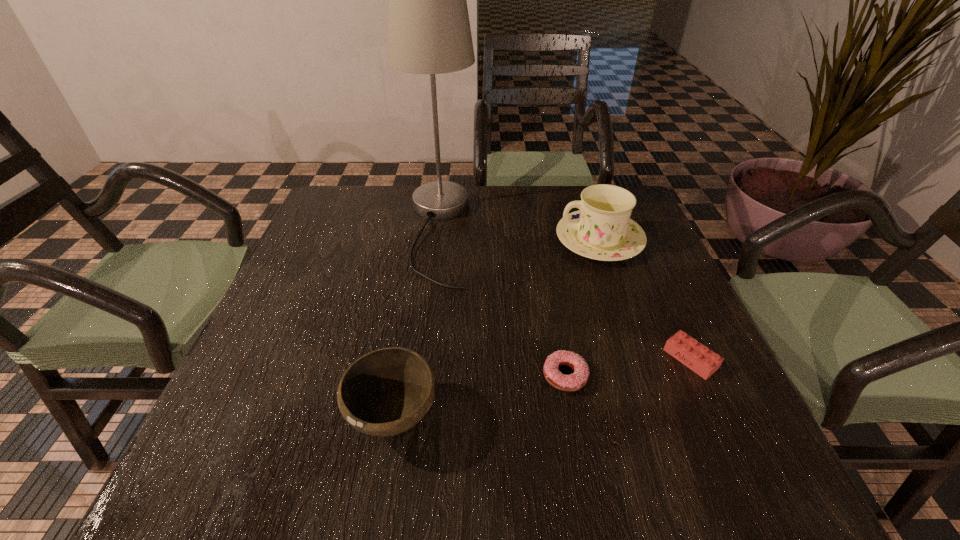
Locate an element on the screen. vacant space that is in between the Lego and the second tallest object is located at coordinates (645, 300).

Where is `vacant point located between the Lego and the chinaware`? The width and height of the screenshot is (960, 540). vacant point located between the Lego and the chinaware is located at coordinates (645, 300).

Locate an element on the screen. Image resolution: width=960 pixels, height=540 pixels. free space between the Lego and the third tallest object is located at coordinates (541, 388).

Select which object is the closest to the Lego. Please provide its 2D coordinates. Your answer should be formatted as a tuple, i.e. [(x, y)], where the tuple contains the x and y coordinates of a point satisfying the conditions above.

[(570, 383)]

Locate which object is the third closest to the doughnut. Please provide its 2D coordinates. Your answer should be formatted as a tuple, i.e. [(x, y)], where the tuple contains the x and y coordinates of a point satisfying the conditions above.

[(429, 32)]

Identify the location of vacant space that satisfies the following two spatial constraints: 1. on the handle side of the chinaware; 2. on the back side of the Lego. (640, 359).

Locate an element on the screen. The width and height of the screenshot is (960, 540). free region that satisfies the following two spatial constraints: 1. on the handle side of the chinaware; 2. on the front side of the bowl is located at coordinates (660, 416).

Identify the location of blank area in the image that satisfies the following two spatial constraints: 1. on the handle side of the Lego; 2. on the right side of the chinaware. (640, 359).